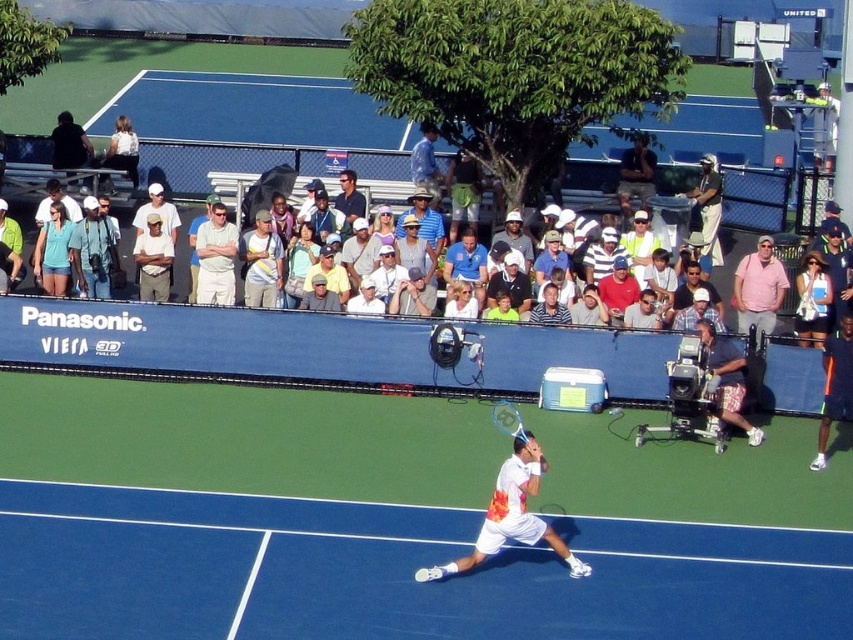
You are a tennis player standing at the baseline during a match. You notice two points marked on the court, point 1 at coordinates point (138,275) and point 2 at coordinates point (345,208). Which point is closer to you?

Point (138,275) is closer to the viewer than point (345,208), so point 1 is closer to you.

You are a tennis coach analyzing a player during a match. You notice the player is positioned at the center of the court. Where exactly on the player is the point at coordinates [154,260] located?

The point at coordinates [154,260] corresponds to the white cotton shirt at center.

You are a photographer positioned at the camera. You need to capture a closeup shot of the dark blue shirt at center. The minimum focusing distance of your camera is 50 feet. Can you take the photo without moving closer?

The dark blue shirt at center is 67.23 feet from the camera, which is beyond the minimum focusing distance of 50 feet. Therefore, you can take the closeup shot without moving closer.